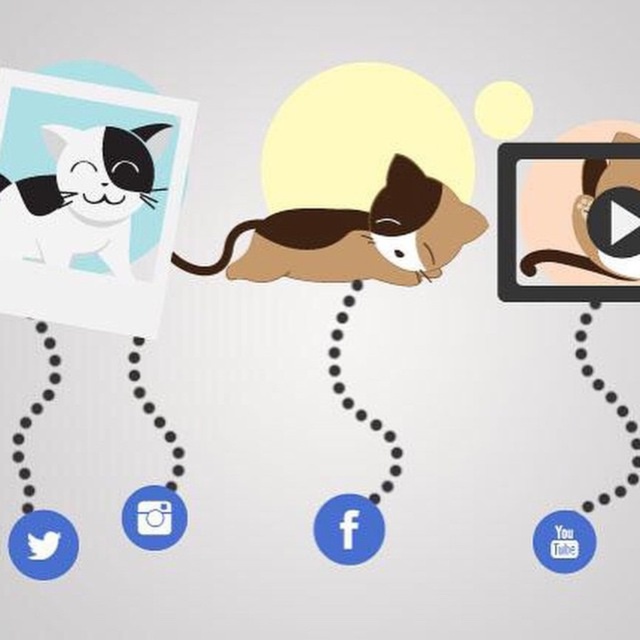
Is brown plush cat at center further to the viewer compared to matte black cat at upper left?

That is True.

Is brown plush cat at center bigger than matte black cat at upper left?

Correct, brown plush cat at center is larger in size than matte black cat at upper left.

The image size is (640, 640). Describe the element at coordinates (356, 236) in the screenshot. I see `brown plush cat at center` at that location.

You are a GUI agent. You are given a task and a screenshot of the screen. Output one action in this format:
    pyautogui.click(x=<x>, y=<y>)
    Task: Click on the brown plush cat at center
    Image resolution: width=640 pixels, height=640 pixels.
    Given the screenshot: What is the action you would take?
    pyautogui.click(x=356, y=236)